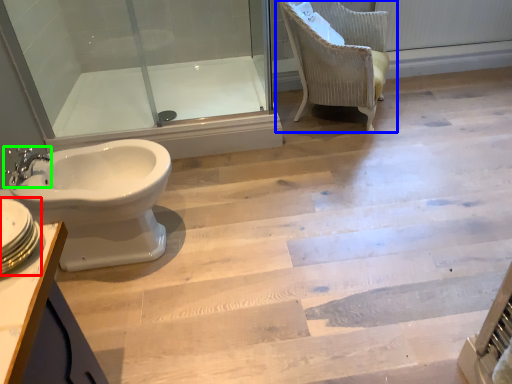
Question: Which is farther away from sink (highlighted by a red box)? chair (highlighted by a blue box) or tap (highlighted by a green box)?

Choices:
 (A) chair
 (B) tap

Answer: (A)